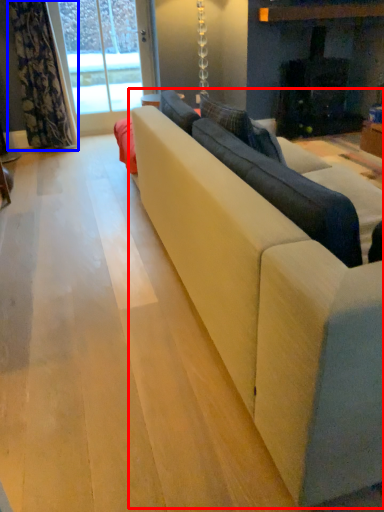
Question: Which of the following is the closest to the observer, studio couch (highlighted by a red box) or curtain (highlighted by a blue box)?

Choices:
 (A) studio couch
 (B) curtain

Answer: (A)